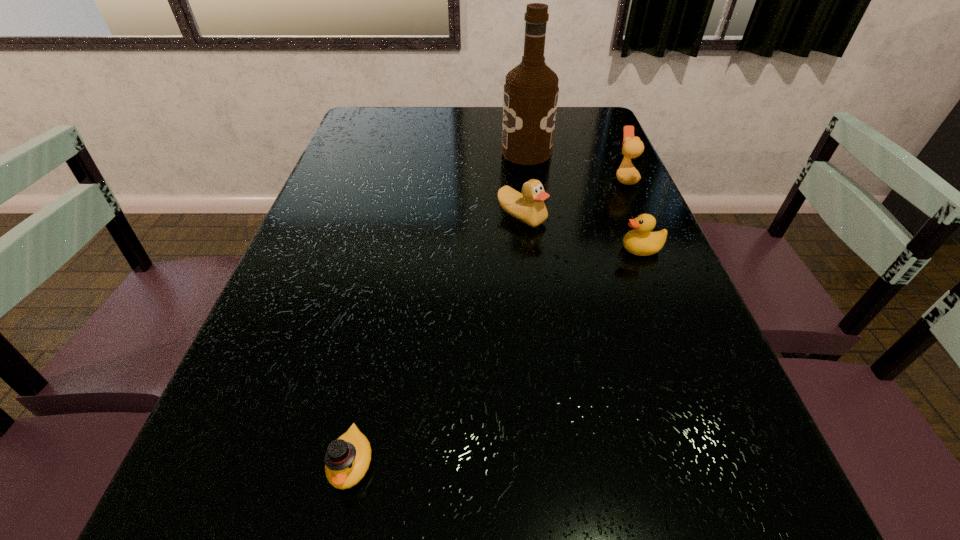
Find the location of a particular element. Image resolution: width=960 pixels, height=540 pixels. vacant space located 0.240m on the label of the alcohol is located at coordinates (423, 152).

This screenshot has height=540, width=960. Identify the location of free spot located 0.260m on the label of the alcohol. (417, 152).

What are the coordinates of `vacant region located on the beak of the farthest duck` in the screenshot? It's located at (521, 179).

Where is `free space located 0.220m on the beak of the farthest duck`? free space located 0.220m on the beak of the farthest duck is located at coordinates tap(536, 179).

Image resolution: width=960 pixels, height=540 pixels. I want to click on free point located on the beak of the farthest duck, so click(511, 179).

Locate an element on the screen. Image resolution: width=960 pixels, height=540 pixels. vacant space situated at the beak of the third duck from right to left is located at coordinates (528, 269).

I want to click on vacant space located 0.060m at the beak of the second shortest duck, so coord(595,249).

Find the location of a particular element. free space located 0.400m at the beak of the second shortest duck is located at coordinates (448, 249).

This screenshot has width=960, height=540. In order to click on free space located 0.120m at the beak of the second shortest duck in this screenshot , I will do pyautogui.click(x=569, y=249).

You are a GUI agent. You are given a task and a screenshot of the screen. Output one action in this format:
    pyautogui.click(x=<x>, y=<y>)
    Task: Click on the vacant space at the far edge
    
    Given the screenshot: What is the action you would take?
    pyautogui.click(x=462, y=107)